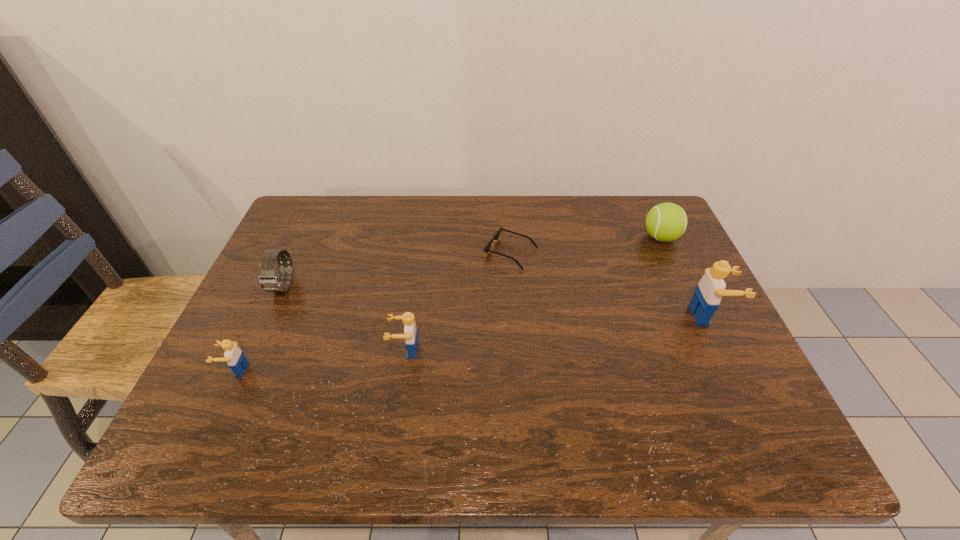
You are a GUI agent. You are given a task and a screenshot of the screen. Output one action in this format:
    pyautogui.click(x=<x>, y=<y>)
    Task: Click on the Lego present at the left edge
    This screenshot has height=540, width=960.
    Given the screenshot: What is the action you would take?
    pyautogui.click(x=234, y=356)

Find the location of a particular element. watch located at the left edge is located at coordinates (268, 280).

This screenshot has height=540, width=960. I want to click on Lego present at the right edge, so click(709, 291).

At what (x,y) coordinates should I click in order to perform the action: click on tennis ball situated at the right edge. Please return your answer as a coordinate pair (x, y). Looking at the image, I should click on (665, 222).

Find the location of a particular element. The image size is (960, 540). object present at the near left corner is located at coordinates (234, 356).

Find the location of a particular element. The width and height of the screenshot is (960, 540). object that is positioned at the far right corner is located at coordinates (665, 222).

This screenshot has width=960, height=540. I want to click on free space at the far edge, so click(x=376, y=217).

Identify the location of vacant space at the near edge of the desktop. (540, 390).

In the image, there is a desktop. Where is `vacant space at the left edge`? Image resolution: width=960 pixels, height=540 pixels. vacant space at the left edge is located at coordinates (297, 298).

Identify the location of free space at the right edge of the desktop. The width and height of the screenshot is (960, 540). (688, 281).